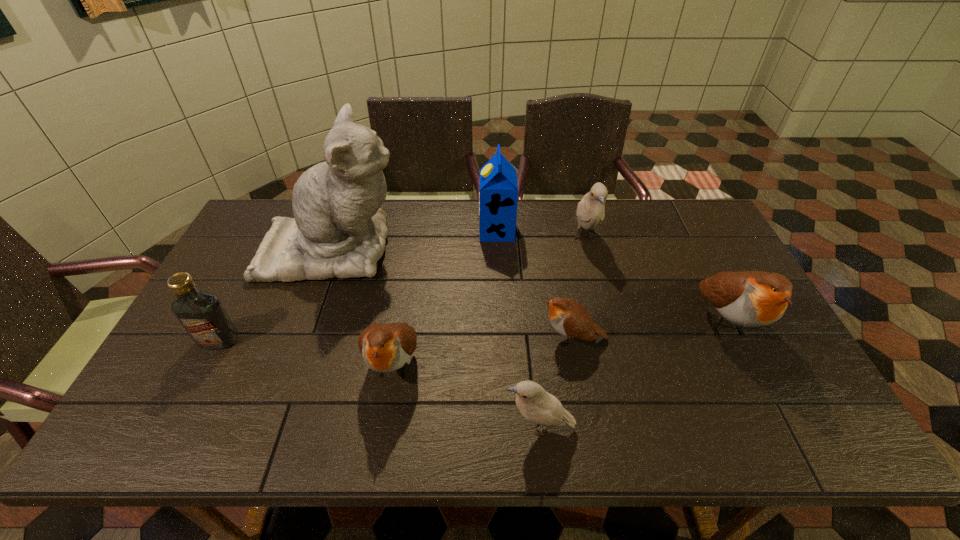
I want to click on cat, so click(x=339, y=230).

This screenshot has width=960, height=540. What are the coordinates of `carton` in the screenshot? It's located at (498, 197).

Locate an element on the screen. Image resolution: width=960 pixels, height=540 pixels. the rightmost bird is located at coordinates (748, 298).

Find the location of `the rightmost brown bird`. the rightmost brown bird is located at coordinates (748, 298).

You are a GUI agent. You are given a task and a screenshot of the screen. Output one action in this format:
    pyautogui.click(x=<x>, y=<y>)
    Task: Click on the right white bird
    
    Given the screenshot: What is the action you would take?
    pyautogui.click(x=590, y=210)

At what (x,y) coordinates should I click in order to perform the action: click on the farther white bird. Please return your answer as a coordinate pair (x, y). The image size is (960, 540). Looking at the image, I should click on (590, 210).

Identify the location of vodka. (202, 315).

You are a GUI agent. You are given a task and a screenshot of the screen. Output one action in this format:
    pyautogui.click(x=<x>, y=<y>)
    Task: Click on the leftmost brown bird
    The width and height of the screenshot is (960, 540).
    Given the screenshot: What is the action you would take?
    pyautogui.click(x=387, y=347)

Identify the location of the second biggest brown bird. This screenshot has width=960, height=540. (387, 347).

Find the location of a particular element. This screenshot has height=540, width=960. the nearer white bird is located at coordinates (535, 404).